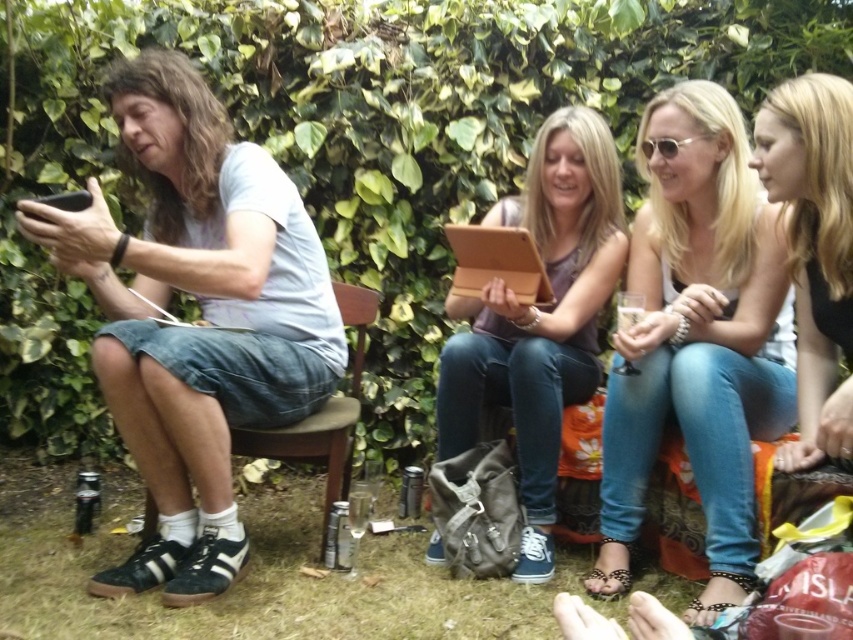
Does light blue t-shirt at left have a larger size compared to matte brown tablet at center?

Indeed, light blue t-shirt at left has a larger size compared to matte brown tablet at center.

Between point (70, 232) and point (476, 394), which one is positioned behind?

Positioned behind is point (476, 394).

Measure the distance between light blue t-shirt at left and camera.

They are 4.97 feet apart.

Locate an element on the screen. light blue t-shirt at left is located at coordinates (202, 316).

Is matte brown tablet at center above blonde hair at upper right?

Incorrect, matte brown tablet at center is not positioned above blonde hair at upper right.

Does point (532, 211) come behind point (784, 444)?

Yes, point (532, 211) is farther from viewer.

The width and height of the screenshot is (853, 640). I want to click on matte brown tablet at center, so click(540, 317).

Does green leafy ivy at upper center have a larger size compared to blonde hair at upper right?

Indeed, green leafy ivy at upper center has a larger size compared to blonde hair at upper right.

Does green leafy ivy at upper center have a lesser width compared to blonde hair at upper right?

In fact, green leafy ivy at upper center might be wider than blonde hair at upper right.

Is point (245, 106) positioned in front of point (828, 152)?

No, (245, 106) is behind (828, 152).

The width and height of the screenshot is (853, 640). I want to click on green leafy ivy at upper center, so click(x=349, y=147).